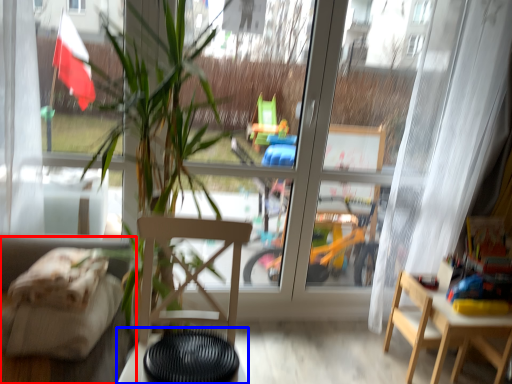
Question: Among these objects, which one is farthest to the camera, couch (highlighted by a red box) or table (highlighted by a blue box)?

Choices:
 (A) couch
 (B) table

Answer: (B)